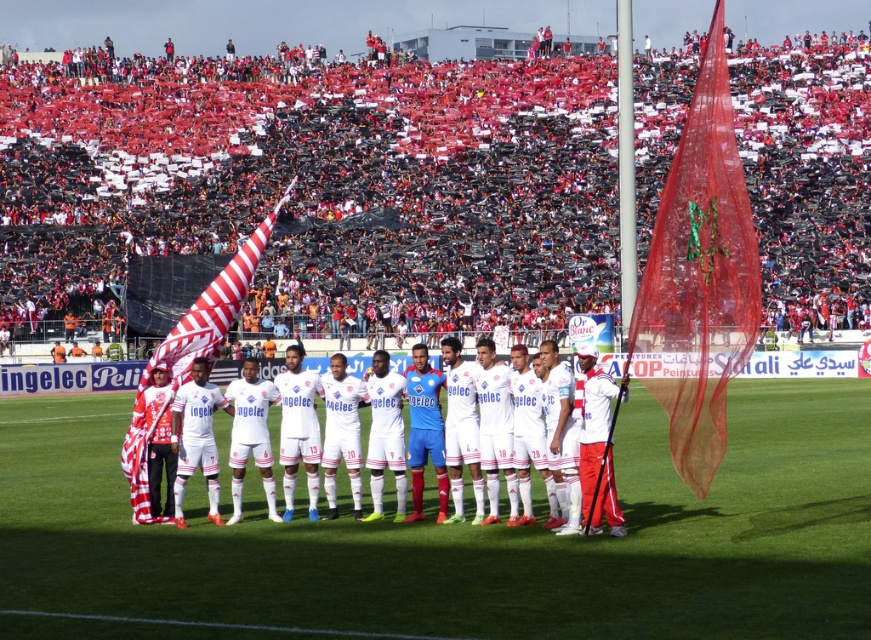
Who is shorter, green grass football field at center or white matte soccer team at center?

Standing shorter between the two is green grass football field at center.

Is green grass football field at center shorter than white matte soccer team at center?

Yes, green grass football field at center is shorter than white matte soccer team at center.

Locate an element on the screen. Image resolution: width=871 pixels, height=640 pixels. green grass football field at center is located at coordinates (458, 540).

Does translucent red flag at right have a larger size compared to striped fabric flag at center?

Incorrect, translucent red flag at right is not larger than striped fabric flag at center.

Who is higher up, translucent red flag at right or striped fabric flag at center?

translucent red flag at right

Which is in front, point (721, 138) or point (204, 340)?

Positioned in front is point (721, 138).

Locate an element on the screen. The height and width of the screenshot is (640, 871). translucent red flag at right is located at coordinates (699, 276).

Which of these two, white matte soccer team at center or striped fabric flag at center, stands taller?

Standing taller between the two is striped fabric flag at center.

Does point (147, 422) come in front of point (174, 376)?

Yes, it is in front of point (174, 376).

Which is in front, point (356, 404) or point (255, 241)?

Point (356, 404) is more forward.

Identify the location of white matte soccer team at center. (159, 422).